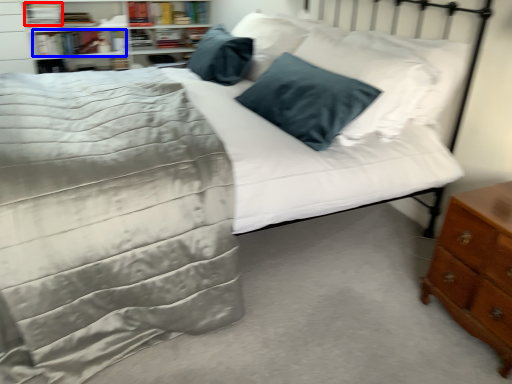
Question: Which object is closer to the camera taking this photo, book (highlighted by a red box) or book (highlighted by a blue box)?

Choices:
 (A) book
 (B) book

Answer: (A)